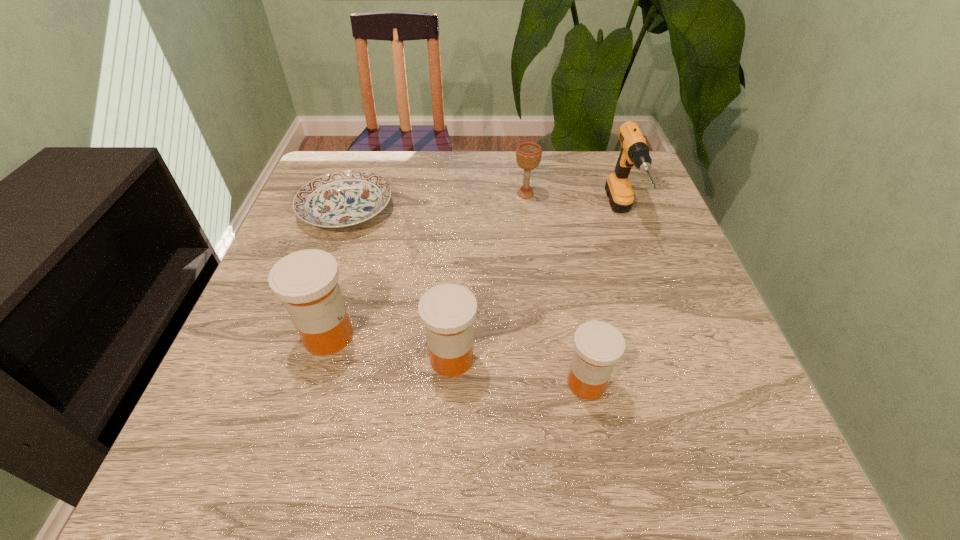
In order to click on vacant region that satisfies the following two spatial constraints: 1. on the front side of the chalice; 2. on the label of the leftmost medicine in this screenshot , I will do `click(542, 336)`.